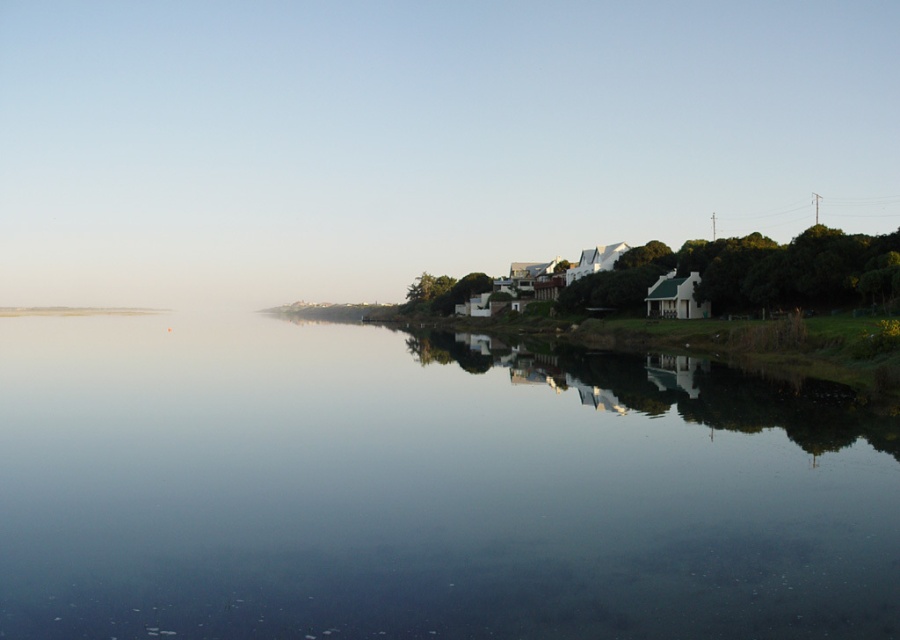
Does point (712, 563) come behind point (777, 276)?

No.

Can you confirm if transparent water at center is wider than green leafy tree at right?

Correct, the width of transparent water at center exceeds that of green leafy tree at right.

Describe the element at coordinates (424, 490) in the screenshot. I see `transparent water at center` at that location.

The image size is (900, 640). I want to click on transparent water at center, so click(424, 490).